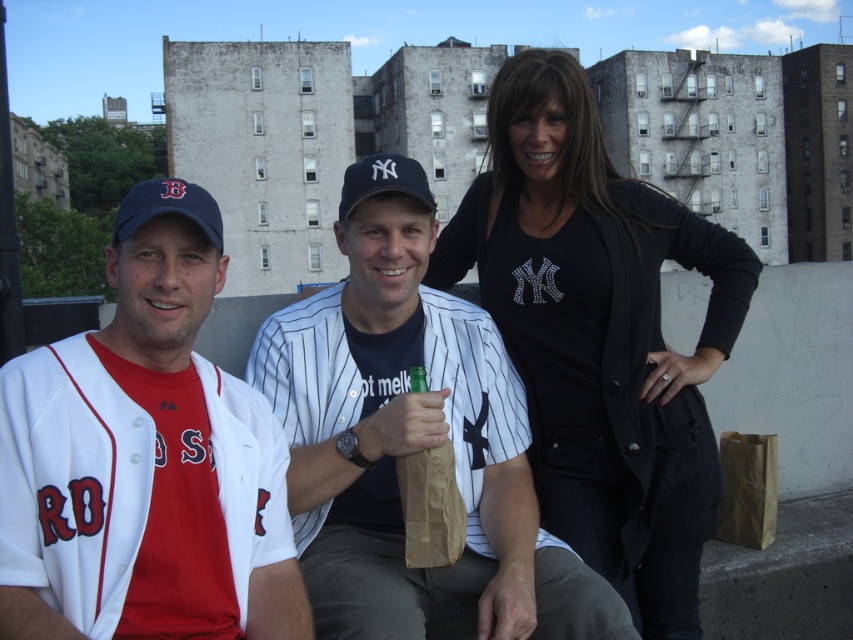
Is black matte/black cardigan at upper right above brown paper bag at lower right?

Correct, black matte/black cardigan at upper right is located above brown paper bag at lower right.

Does black matte/black cardigan at upper right appear on the right side of brown paper bag at lower right?

In fact, black matte/black cardigan at upper right is to the left of brown paper bag at lower right.

Locate an element on the screen. This screenshot has width=853, height=640. black matte/black cardigan at upper right is located at coordinates (599, 336).

From the picture: Is black matte/black cardigan at upper right closer to the viewer compared to white matte baseball jersey at center?

No, it is behind white matte baseball jersey at center.

Can you confirm if black matte/black cardigan at upper right is positioned above white matte baseball jersey at center?

Yes, black matte/black cardigan at upper right is above white matte baseball jersey at center.

Does point (474, 224) come behind point (39, 624)?

Yes, point (474, 224) is behind point (39, 624).

Find the location of a particular element. This screenshot has height=640, width=853. black matte/black cardigan at upper right is located at coordinates (599, 336).

The height and width of the screenshot is (640, 853). Describe the element at coordinates (144, 460) in the screenshot. I see `white matte baseball jersey at center` at that location.

Find the location of a particular element. Image resolution: width=853 pixels, height=640 pixels. white matte baseball jersey at center is located at coordinates (144, 460).